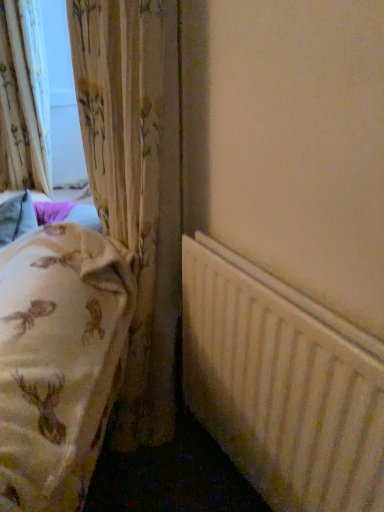
The width and height of the screenshot is (384, 512). I want to click on floral fabric curtain at left, positioned as the second curtain in front-to-back order, so click(x=24, y=99).

Locate an element on the screen. This screenshot has height=512, width=384. floral fabric curtain at left, the 1th curtain in the front-to-back sequence is located at coordinates (136, 185).

Identify the location of white matte radiator at lower right. This screenshot has height=512, width=384. (282, 385).

What is the approximate height of white matte radiator at lower right?

white matte radiator at lower right is 29.83 inches in height.

Image resolution: width=384 pixels, height=512 pixels. I want to click on floral fabric curtain at left, positioned as the second curtain in front-to-back order, so click(24, 99).

Considering the relative sizes of floral fabric curtain at left, positioned as the second curtain in front-to-back order, and floral fabric curtain at left, acting as the first curtain starting from the right, in the image provided, is floral fabric curtain at left, positioned as the second curtain in front-to-back order, thinner than floral fabric curtain at left, acting as the first curtain starting from the right,?

No.

Based on the photo, from a real-world perspective, is floral fabric curtain at left, marked as the 1th curtain in a left-to-right arrangement, physically located above or below floral fabric curtain at left, the second curtain viewed from the left?

From a real-world perspective, floral fabric curtain at left, marked as the 1th curtain in a left-to-right arrangement, is physically above floral fabric curtain at left, the second curtain viewed from the left.

Considering the sizes of objects floral fabric curtain at left, the first curtain from the back, and floral fabric curtain at left, the 1th curtain in the front-to-back sequence, in the image provided, who is smaller, floral fabric curtain at left, the first curtain from the back, or floral fabric curtain at left, the 1th curtain in the front-to-back sequence,?

floral fabric curtain at left, the 1th curtain in the front-to-back sequence.

Is floral fabric curtain at left, marked as the 1th curtain in a left-to-right arrangement, beside floral fabric curtain at left, the 1th curtain in the front-to-back sequence?

No, floral fabric curtain at left, marked as the 1th curtain in a left-to-right arrangement, is not making contact with floral fabric curtain at left, the 1th curtain in the front-to-back sequence.

Considering the positions of objects floral fabric curtain at left, which is the 2th curtain from back to front, and white matte radiator at lower right in the image provided, who is more to the right, floral fabric curtain at left, which is the 2th curtain from back to front, or white matte radiator at lower right?

white matte radiator at lower right is more to the right.

The height and width of the screenshot is (512, 384). In the image, there is a floral fabric curtain at left, which is the 2th curtain from back to front. Identify the location of radiator below it (from a real-world perspective). (282, 385).

Does floral fabric curtain at left, which is the 2th curtain from back to front, have a smaller size compared to white matte radiator at lower right?

Incorrect, floral fabric curtain at left, which is the 2th curtain from back to front, is not smaller in size than white matte radiator at lower right.

How different are the orientations of floral fabric curtain at left, the 1th curtain in the front-to-back sequence, and white matte radiator at lower right in degrees?

There is a 1.23-degree angle between the facing directions of floral fabric curtain at left, the 1th curtain in the front-to-back sequence, and white matte radiator at lower right.

Can you tell me how much floral fabric curtain at left, the 1th curtain in the front-to-back sequence, and floral fabric curtain at left, the first curtain from the back, differ in facing direction?

floral fabric curtain at left, the 1th curtain in the front-to-back sequence, and floral fabric curtain at left, the first curtain from the back, are facing 0.000896 degrees away from each other.

Is floral fabric curtain at left, which is the 2th curtain from back to front, taller or shorter than floral fabric curtain at left, positioned as the second curtain in front-to-back order?

floral fabric curtain at left, which is the 2th curtain from back to front, is taller than floral fabric curtain at left, positioned as the second curtain in front-to-back order.

Does floral fabric curtain at left, which is the 2th curtain from back to front, appear on the left side of floral fabric curtain at left, positioned as the second curtain in front-to-back order?

In fact, floral fabric curtain at left, which is the 2th curtain from back to front, is to the right of floral fabric curtain at left, positioned as the second curtain in front-to-back order.

Which object is more forward, floral fabric curtain at left, the 1th curtain in the front-to-back sequence, or floral fabric curtain at left, the first curtain from the back?

floral fabric curtain at left, the 1th curtain in the front-to-back sequence.

Is white matte radiator at lower right positioned with its back to floral fabric curtain at left, the first curtain from the back?

No, floral fabric curtain at left, the first curtain from the back, is not at the back of white matte radiator at lower right.

Considering the relative sizes of white matte radiator at lower right and floral fabric curtain at left, positioned as the second curtain in front-to-back order, in the image provided, is white matte radiator at lower right shorter than floral fabric curtain at left, positioned as the second curtain in front-to-back order,?

Yes, white matte radiator at lower right is shorter than floral fabric curtain at left, positioned as the second curtain in front-to-back order.

From a real-world perspective, is white matte radiator at lower right located beneath floral fabric curtain at left, the first curtain from the back?

Yes, from a real-world perspective, white matte radiator at lower right is below floral fabric curtain at left, the first curtain from the back.

In the scene shown: Does white matte radiator at lower right have a lesser height compared to floral fabric curtain at left, acting as the first curtain starting from the right?

Indeed, white matte radiator at lower right has a lesser height compared to floral fabric curtain at left, acting as the first curtain starting from the right.

Considering the positions of objects white matte radiator at lower right and floral fabric curtain at left, which is the 2th curtain from back to front, in the image provided, who is more to the left, white matte radiator at lower right or floral fabric curtain at left, which is the 2th curtain from back to front,?

floral fabric curtain at left, which is the 2th curtain from back to front.

From a real-world perspective, is white matte radiator at lower right on floral fabric curtain at left, acting as the first curtain starting from the right?

No, from a real-world perspective, white matte radiator at lower right is not above floral fabric curtain at left, acting as the first curtain starting from the right.

Is floral fabric curtain at left, which appears as the 2th curtain when viewed from the right, positioned far away from white matte radiator at lower right?

That's right, there is a large distance between floral fabric curtain at left, which appears as the 2th curtain when viewed from the right, and white matte radiator at lower right.

Is point (43, 170) less distant than point (369, 399)?

No, it is behind (369, 399).

Considering the relative sizes of floral fabric curtain at left, the first curtain from the back, and white matte radiator at lower right in the image provided, is floral fabric curtain at left, the first curtain from the back, bigger than white matte radiator at lower right?

Indeed, floral fabric curtain at left, the first curtain from the back, has a larger size compared to white matte radiator at lower right.

In the image, is floral fabric curtain at left, which appears as the 2th curtain when viewed from the right, on the left side or the right side of white matte radiator at lower right?

floral fabric curtain at left, which appears as the 2th curtain when viewed from the right, is positioned on white matte radiator at lower right's left side.

This screenshot has width=384, height=512. In order to click on curtain that is behind the floral fabric curtain at left, the second curtain viewed from the left in this screenshot , I will do `click(24, 99)`.

At what (x,y) coordinates should I click in order to perform the action: click on radiator in front of the floral fabric curtain at left, the 1th curtain in the front-to-back sequence. Please return your answer as a coordinate pair (x, y). Looking at the image, I should click on (282, 385).

Which object lies nearer to the anchor point white matte radiator at lower right, floral fabric curtain at left, the 1th curtain in the front-to-back sequence, or floral fabric curtain at left, marked as the 1th curtain in a left-to-right arrangement?

Among the two, floral fabric curtain at left, the 1th curtain in the front-to-back sequence, is located nearer to white matte radiator at lower right.

Which object lies further to the anchor point floral fabric curtain at left, the second curtain viewed from the left, floral fabric curtain at left, positioned as the second curtain in front-to-back order, or white matte radiator at lower right?

Among the two, floral fabric curtain at left, positioned as the second curtain in front-to-back order, is located further to floral fabric curtain at left, the second curtain viewed from the left.

Considering their positions, is floral fabric curtain at left, positioned as the second curtain in front-to-back order, positioned closer to white matte radiator at lower right than floral fabric curtain at left, acting as the first curtain starting from the right?

Among the two, floral fabric curtain at left, acting as the first curtain starting from the right, is located nearer to white matte radiator at lower right.

When comparing their distances from floral fabric curtain at left, the first curtain from the back, does white matte radiator at lower right or floral fabric curtain at left, which is the 2th curtain from back to front, seem further?

white matte radiator at lower right.

Looking at the image, which one is located further to floral fabric curtain at left, marked as the 1th curtain in a left-to-right arrangement, floral fabric curtain at left, the 1th curtain in the front-to-back sequence, or white matte radiator at lower right?

white matte radiator at lower right is positioned further to the anchor floral fabric curtain at left, marked as the 1th curtain in a left-to-right arrangement.

From the image, which object appears to be nearer to floral fabric curtain at left, which is the 2th curtain from back to front, white matte radiator at lower right or floral fabric curtain at left, marked as the 1th curtain in a left-to-right arrangement?

white matte radiator at lower right is closer to floral fabric curtain at left, which is the 2th curtain from back to front.

At what (x,y) coordinates should I click in order to perform the action: click on curtain situated between floral fabric curtain at left, the first curtain from the back, and white matte radiator at lower right from left to right. Please return your answer as a coordinate pair (x, y). Looking at the image, I should click on (136, 185).